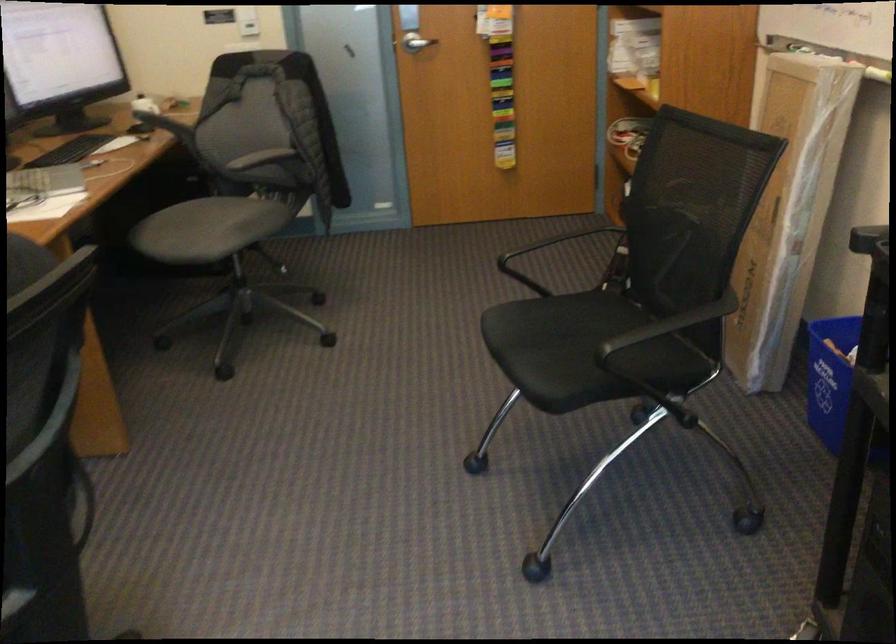
Find the location of `black chair armrest`. black chair armrest is located at coordinates (573, 259).